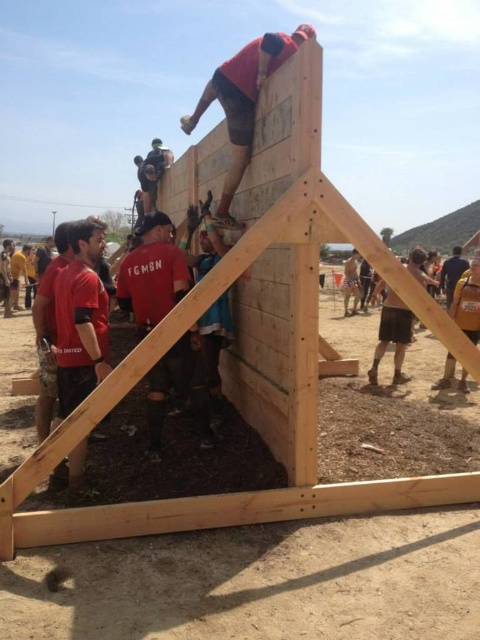
Measure the distance between point (x=81, y=346) and camera.

They are 3.85 meters apart.

Based on the photo, which is more to the left, matte red shirt at left or dark blue jeans at right?

From the viewer's perspective, matte red shirt at left appears more on the left side.

Who is more forward, (72, 252) or (443, 266)?

Point (72, 252) is more forward.

Identify the location of matte red shirt at left. This screenshot has width=480, height=640. (81, 320).

Is matte red shirt at center thinner than matte red shirt at upper center?

Yes.

Between matte red shirt at center and matte red shirt at upper center, which one has less height?

matte red shirt at center

Is point (173, 292) farther from camera compared to point (222, 209)?

That is False.

The width and height of the screenshot is (480, 640). In order to click on matte red shirt at center in this screenshot , I will do `click(153, 275)`.

Is dark blue jeans at right above yellow fabric shirt at lower left?

Yes.

From the picture: Is dark blue jeans at right bigger than yellow fabric shirt at lower left?

Yes, dark blue jeans at right is bigger than yellow fabric shirt at lower left.

Between point (441, 280) and point (21, 282), which one is positioned in front?

Positioned in front is point (441, 280).

Find the location of a particular element. The height and width of the screenshot is (640, 480). dark blue jeans at right is located at coordinates (452, 273).